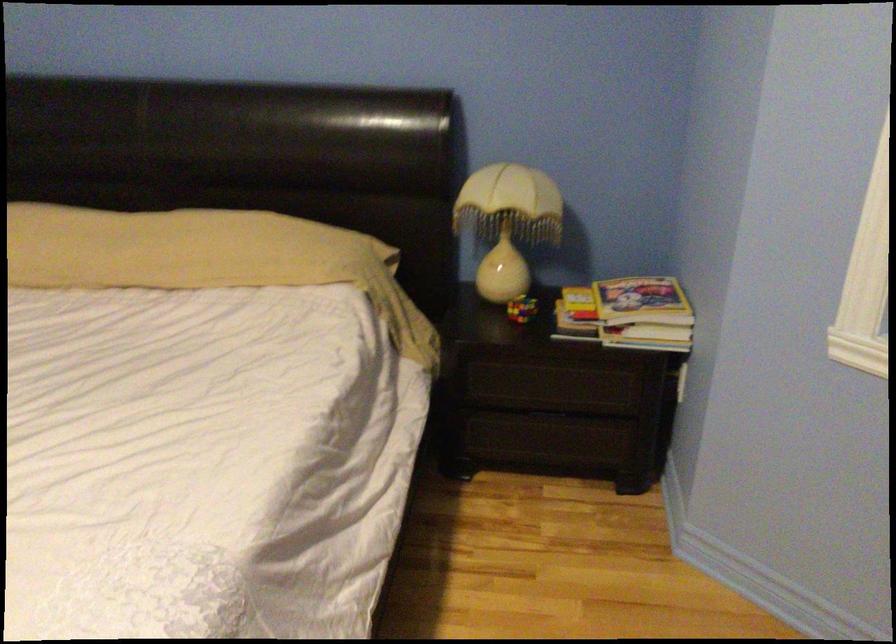
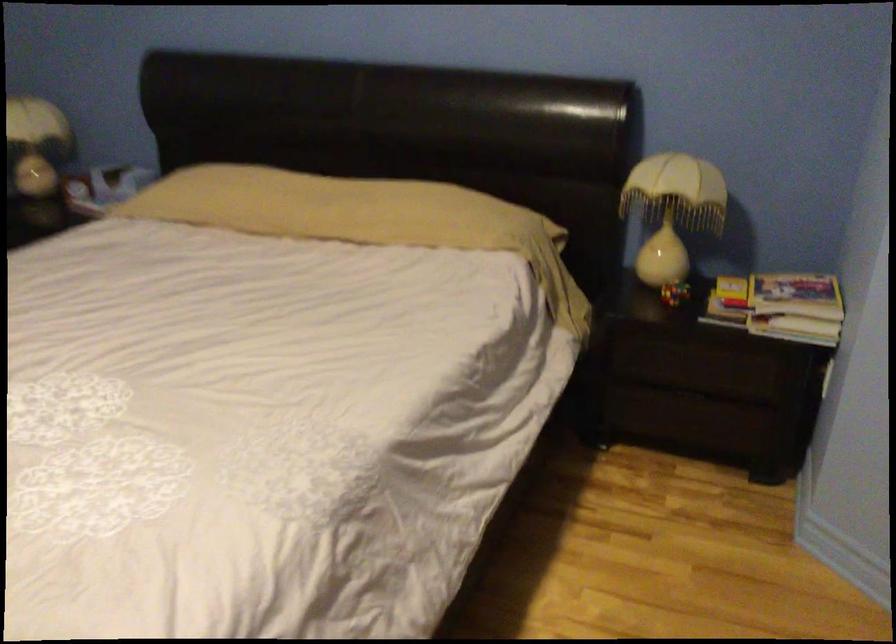
The images are taken continuously from a first-person perspective. In which direction are you moving?

The cameraman walked toward right, backward.